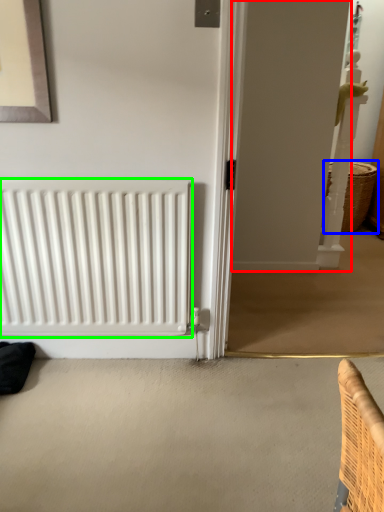
Question: Considering the real-world distances, which object is closest to screen door (highlighted by a red box)? basket (highlighted by a blue box) or radiator (highlighted by a green box).

Choices:
 (A) basket
 (B) radiator

Answer: (A)